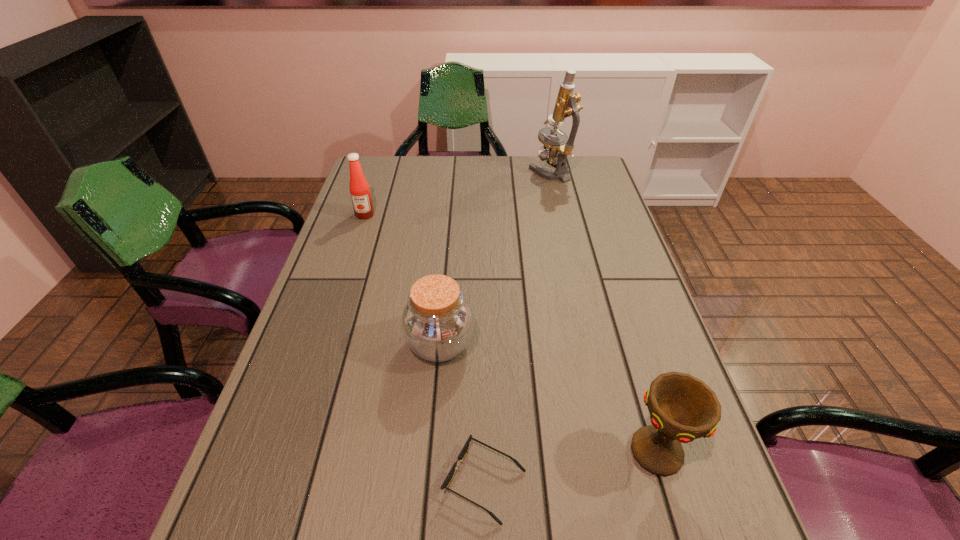
What are the coordinates of `vacant space at the left edge of the desktop` in the screenshot? It's located at pos(255,455).

In the image, there is a desktop. At what (x,y) coordinates should I click in order to perform the action: click on vacant space at the right edge. Please return your answer as a coordinate pair (x, y). This screenshot has height=540, width=960. Looking at the image, I should click on (588, 217).

Identify the location of vacant space at the far left corner of the desktop. (394, 161).

In the image, there is a desktop. Identify the location of vacant space at the far right corner. The height and width of the screenshot is (540, 960). coord(588,166).

The width and height of the screenshot is (960, 540). Find the location of `vacant space that's between the shortest object and the third farthest object`. vacant space that's between the shortest object and the third farthest object is located at coordinates (462, 413).

I want to click on vacant area that lies between the condiment and the chalice, so click(512, 333).

In order to click on empty space that is in between the farthest object and the second farthest object in this screenshot , I will do `click(458, 193)`.

Identify the location of unoccupied position between the fourth nearest object and the chalice. (512, 333).

The image size is (960, 540). Find the location of `free space between the fourth nearest object and the farthest object`. free space between the fourth nearest object and the farthest object is located at coordinates (458, 193).

Where is `free space between the jar and the shortest object`? The image size is (960, 540). free space between the jar and the shortest object is located at coordinates (462, 413).